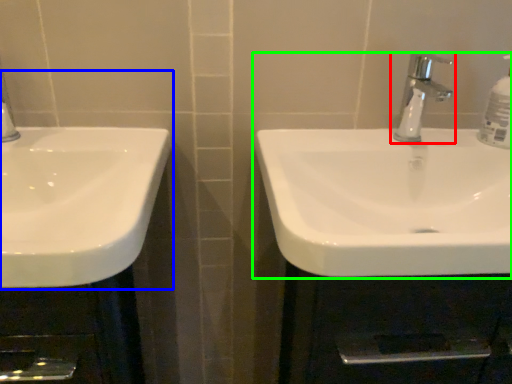
Question: Which object is the closest to the tap (highlighted by a red box)? Choose among these: sink (highlighted by a blue box) or sink (highlighted by a green box).

Choices:
 (A) sink
 (B) sink

Answer: (B)